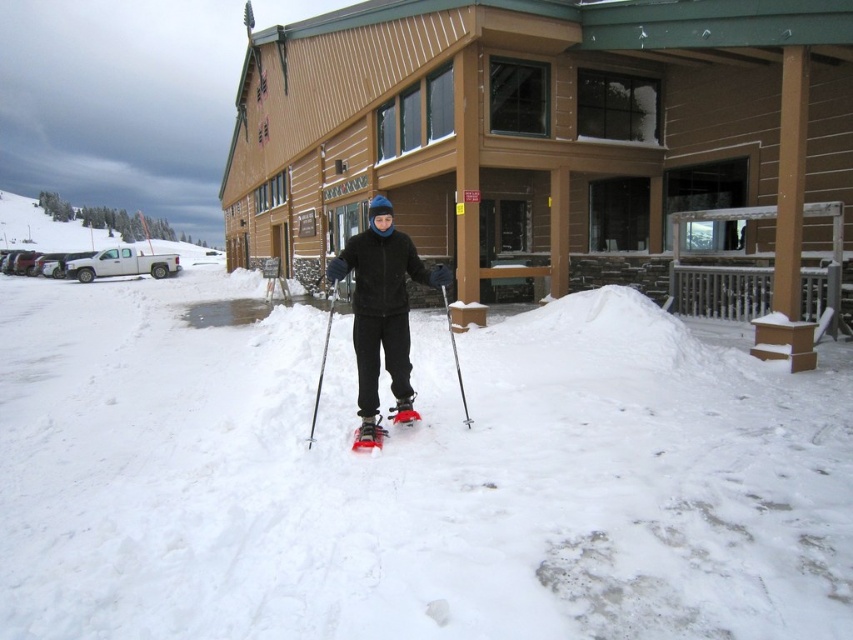
Is silver metallic ski pole at center above red matte snowshoe at center?

Yes, silver metallic ski pole at center is above red matte snowshoe at center.

Where is `silver metallic ski pole at center`? Image resolution: width=853 pixels, height=640 pixels. silver metallic ski pole at center is located at coordinates (456, 355).

Find the location of a particular element. silver metallic ski pole at center is located at coordinates (456, 355).

Does red rubber ski at center have a smaller size compared to red matte snowshoe at center?

Incorrect, red rubber ski at center is not smaller in size than red matte snowshoe at center.

Is red rubber ski at center closer to camera compared to red matte snowshoe at center?

Yes, red rubber ski at center is in front of red matte snowshoe at center.

Looking at this image, who is more forward, (352, 442) or (410, 397)?

Positioned in front is point (352, 442).

This screenshot has width=853, height=640. I want to click on red rubber ski at center, so click(x=369, y=440).

Is matte black ski boots at center smaller than red matte snowshoe at center?

No, matte black ski boots at center is not smaller than red matte snowshoe at center.

Can you confirm if matte black ski boots at center is positioned below red matte snowshoe at center?

No.

Who is more distant from viewer, [369,300] or [412,417]?

The point [412,417] is more distant.

Where is `matte black ski boots at center`? The height and width of the screenshot is (640, 853). matte black ski boots at center is located at coordinates (381, 300).